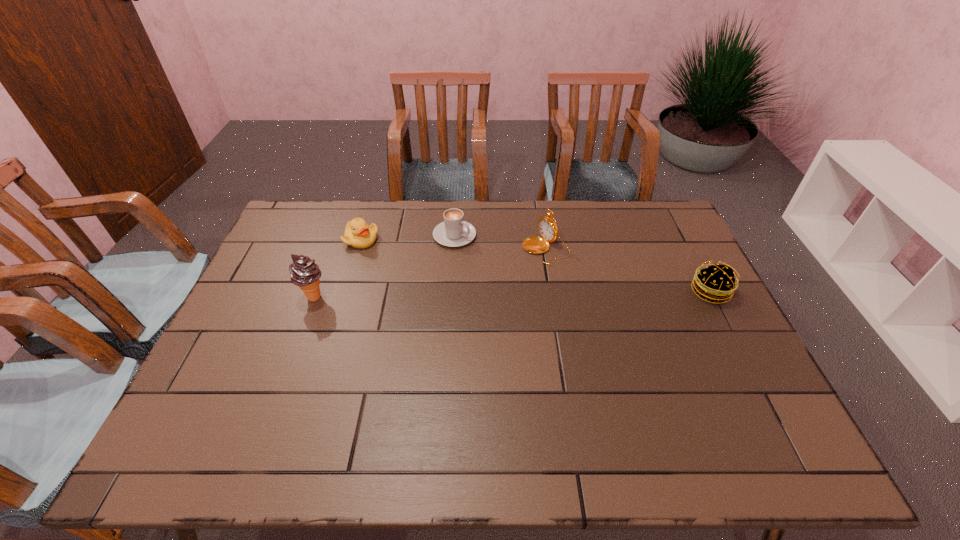
Locate an element on the screen. Image resolution: width=960 pixels, height=540 pixels. object that is at the left edge is located at coordinates (304, 273).

Identify the location of object situated at the right edge. This screenshot has width=960, height=540. (714, 282).

At what (x,y) coordinates should I click in order to perform the action: click on vacant region at the far edge of the desktop. Please return your answer as a coordinate pair (x, y). The height and width of the screenshot is (540, 960). Looking at the image, I should click on (583, 216).

The image size is (960, 540). Identify the location of vacant space at the near edge of the desktop. (522, 391).

Where is `vacant area at the left edge of the desktop`? The width and height of the screenshot is (960, 540). vacant area at the left edge of the desktop is located at coordinates (286, 281).

Where is `free space at the right edge of the desktop`? The image size is (960, 540). free space at the right edge of the desktop is located at coordinates (712, 365).

This screenshot has width=960, height=540. I want to click on free region at the near left corner of the desktop, so click(198, 392).

This screenshot has height=540, width=960. I want to click on empty location between the tallest object and the duckling, so click(x=338, y=268).

You are a GUI agent. You are given a task and a screenshot of the screen. Output one action in this format:
    pyautogui.click(x=<x>, y=<y>)
    Task: Click on the empty location between the duckling and the rightmost object
    This screenshot has width=960, height=540.
    Given the screenshot: What is the action you would take?
    pyautogui.click(x=536, y=266)

This screenshot has width=960, height=540. In order to click on free space between the duckling and the third object from left to right in this screenshot , I will do `click(408, 238)`.